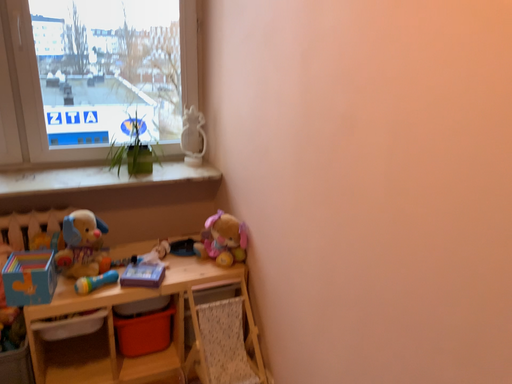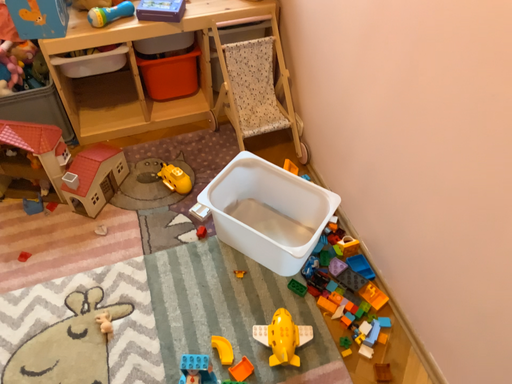
Question: Which way did the camera rotate in the video?

Choices:
 (A) rotated downward
 (B) rotated upward

Answer: (A)